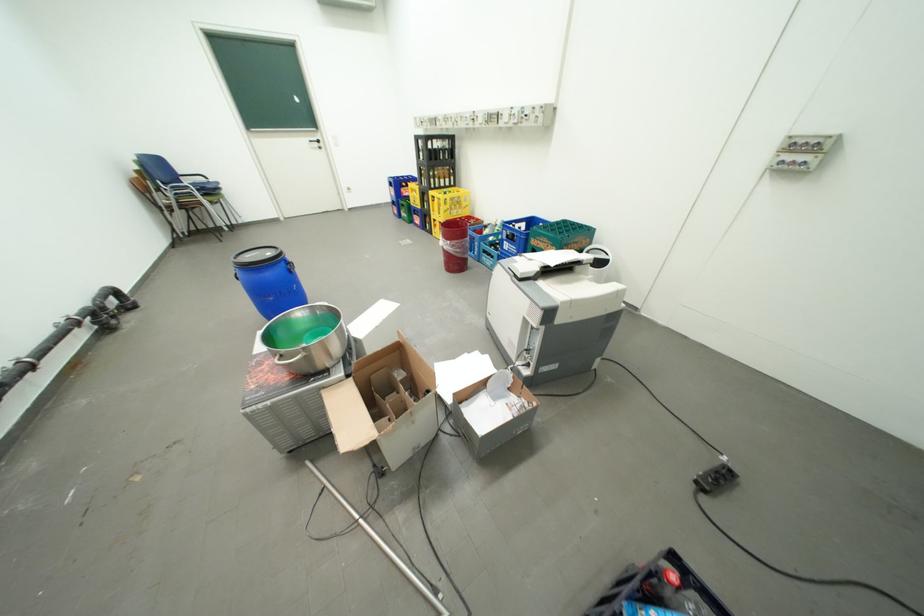
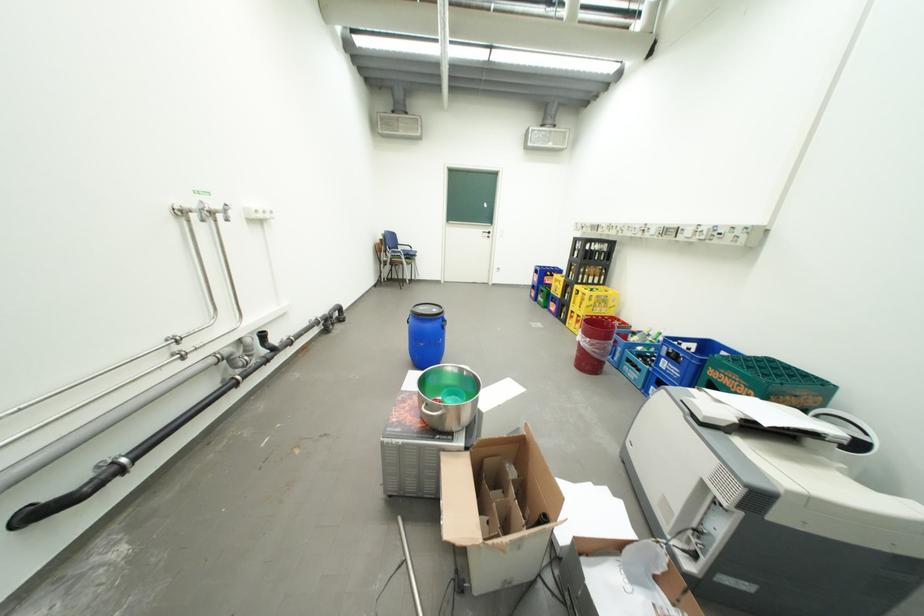
In the second image, find the point that corresponds to [516,244] in the first image.

(674, 361)